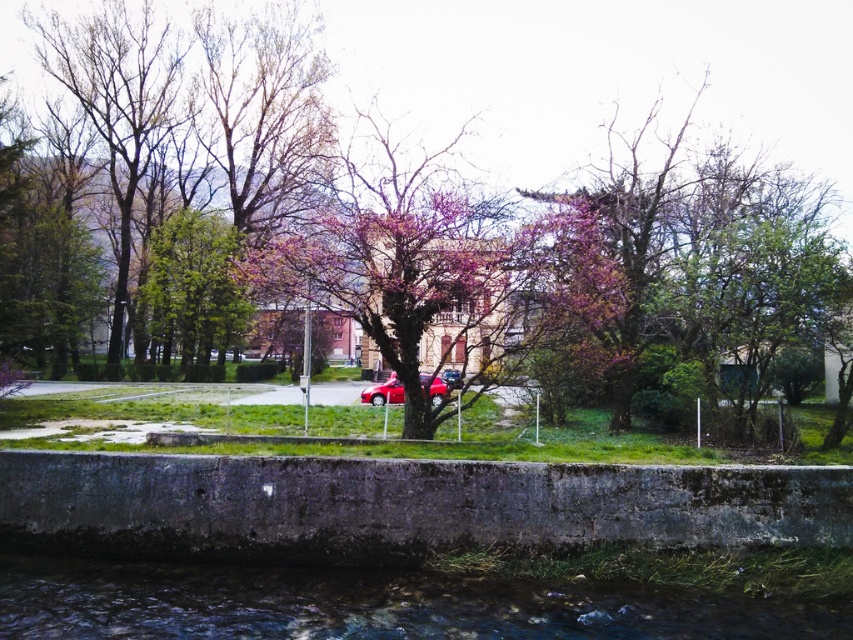
Which of these two, green leafy tree at center or purple bloom at center, stands shorter?

purple bloom at center

You are a GUI agent. You are given a task and a screenshot of the screen. Output one action in this format:
    pyautogui.click(x=<x>, y=<y>)
    Task: Click on the green leafy tree at center
    This screenshot has width=853, height=640.
    Given the screenshot: What is the action you would take?
    pyautogui.click(x=195, y=291)

Is pink blossoming tree at center to the left of purple bloom at center from the viewer's perspective?

Incorrect, pink blossoming tree at center is not on the left side of purple bloom at center.

Which is in front, point (339, 282) or point (254, 248)?

Positioned in front is point (339, 282).

Between point (308, 253) and point (345, 273), which one is positioned behind?

Positioned behind is point (345, 273).

This screenshot has width=853, height=640. I want to click on pink blossoming tree at center, so click(403, 269).

Can you confirm if clear water at lower center is shorter than green leafy tree at center?

Yes, clear water at lower center is shorter than green leafy tree at center.

How much distance is there between clear water at lower center and green leafy tree at center?

A: The distance of clear water at lower center from green leafy tree at center is 37.27 meters.

Is point (799, 620) behind point (212, 252)?

No.

Where is `clear water at lower center`? This screenshot has height=640, width=853. clear water at lower center is located at coordinates (375, 604).